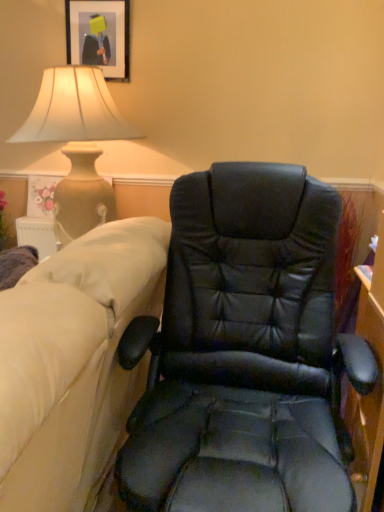
Question: Could you tell me if matte black picture frame at upper left is turned towards black leather chair at center?

Choices:
 (A) yes
 (B) no

Answer: (B)

Question: Does matte black picture frame at upper left have a greater height compared to black leather chair at center?

Choices:
 (A) no
 (B) yes

Answer: (A)

Question: From the image's perspective, does matte black picture frame at upper left appear lower than black leather chair at center?

Choices:
 (A) yes
 (B) no

Answer: (B)

Question: From a real-world perspective, does matte black picture frame at upper left stand above black leather chair at center?

Choices:
 (A) yes
 (B) no

Answer: (A)

Question: Is matte black picture frame at upper left beside black leather chair at center?

Choices:
 (A) yes
 (B) no

Answer: (B)

Question: From the image's perspective, does matte black picture frame at upper left appear higher than black leather chair at center?

Choices:
 (A) no
 (B) yes

Answer: (B)

Question: Can you confirm if black leather chair at center is smaller than matte black picture frame at upper left?

Choices:
 (A) yes
 (B) no

Answer: (B)

Question: From a real-world perspective, is black leather chair at center over matte black picture frame at upper left?

Choices:
 (A) no
 (B) yes

Answer: (A)

Question: Does black leather chair at center have a lesser width compared to matte black picture frame at upper left?

Choices:
 (A) no
 (B) yes

Answer: (A)

Question: From the image's perspective, is black leather chair at center located above matte black picture frame at upper left?

Choices:
 (A) no
 (B) yes

Answer: (A)

Question: Is black leather chair at center positioned behind matte black picture frame at upper left?

Choices:
 (A) no
 (B) yes

Answer: (A)

Question: Is black leather chair at center wider than matte black picture frame at upper left?

Choices:
 (A) yes
 (B) no

Answer: (A)

Question: Is matte black picture frame at upper left bigger or smaller than black leather chair at center?

Choices:
 (A) big
 (B) small

Answer: (B)